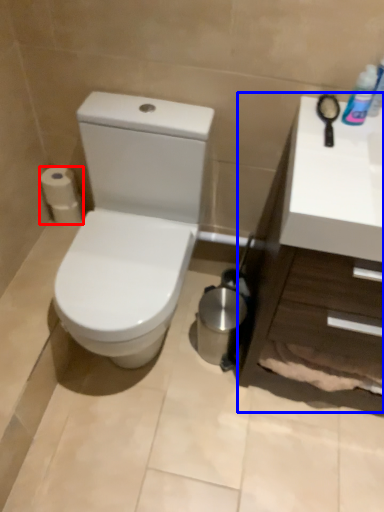
Question: Which point is closer to the camera, toilet paper (highlighted by a red box) or counter top (highlighted by a blue box)?

Choices:
 (A) toilet paper
 (B) counter top

Answer: (B)